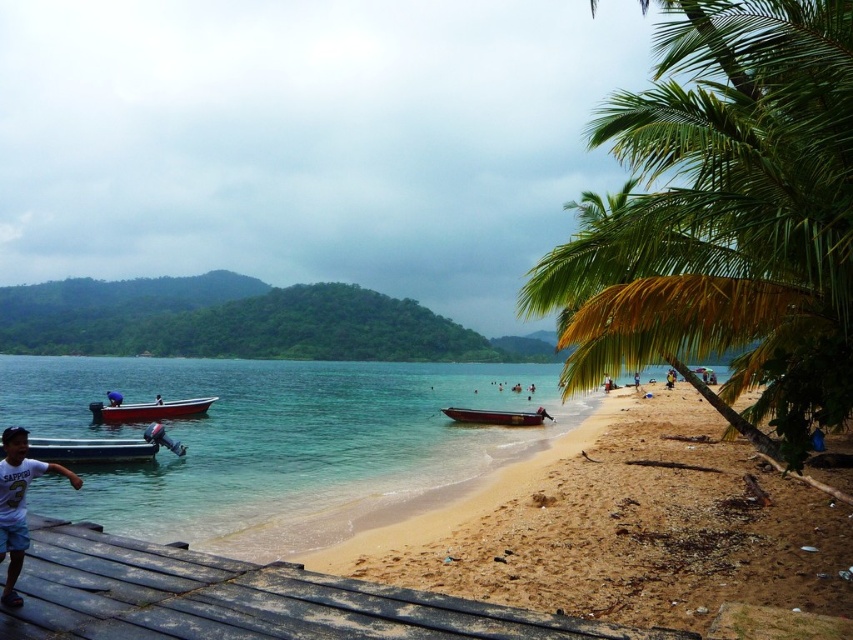
Question: Which of the following is the farthest from the observer?

Choices:
 (A) blue fabric person at lower left
 (B) white plastic boat at left

Answer: (A)

Question: Can you confirm if weathered wood dock at lower left is positioned above white plastic boat at lower left?

Choices:
 (A) no
 (B) yes

Answer: (B)

Question: Does white plastic boat at lower left appear over blue fabric person at lower left?

Choices:
 (A) yes
 (B) no

Answer: (A)

Question: Estimate the real-world distances between objects in this image. Which object is closer to the brown wooden boat at center?

Choices:
 (A) white plastic boat at left
 (B) white cotton shirt at lower left

Answer: (A)

Question: Does weathered wood dock at lower left appear on the left side of brown wooden boat at center?

Choices:
 (A) no
 (B) yes

Answer: (B)

Question: Which object is the farthest from the green leafy palm tree at right?

Choices:
 (A) white plastic boat at left
 (B) clear blue water at lower left
 (C) white plastic boat at lower left
 (D) brown wooden boat at center

Answer: (A)